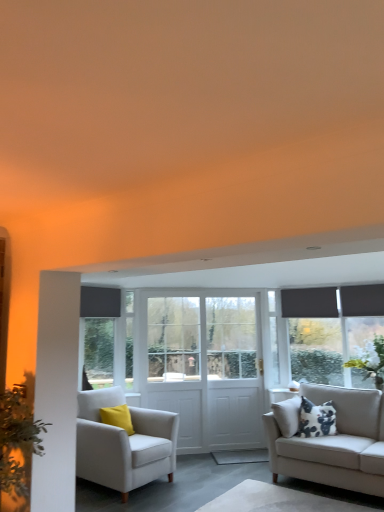
Question: Is white fabric armchair at left to the right of white wooden screen door at center, which ranks as the second screen door in right-to-left order, from the viewer's perspective?

Choices:
 (A) yes
 (B) no

Answer: (B)

Question: Is white fabric armchair at left facing towards white wooden screen door at center, acting as the 1th screen door starting from the left?

Choices:
 (A) no
 (B) yes

Answer: (A)

Question: From the image's perspective, is white fabric armchair at left under white wooden screen door at center, which ranks as the second screen door in right-to-left order?

Choices:
 (A) yes
 (B) no

Answer: (A)

Question: Is white fabric armchair at left facing away from white wooden screen door at center, which ranks as the second screen door in right-to-left order?

Choices:
 (A) yes
 (B) no

Answer: (B)

Question: Does white fabric armchair at left have a larger size compared to white wooden screen door at center, which ranks as the second screen door in right-to-left order?

Choices:
 (A) yes
 (B) no

Answer: (A)

Question: Is white fabric armchair at left positioned behind white wooden screen door at center, which ranks as the second screen door in right-to-left order?

Choices:
 (A) yes
 (B) no

Answer: (B)

Question: Does green leafy plant at left, the second plant from the back, come in front of white fabric rug at lower center?

Choices:
 (A) yes
 (B) no

Answer: (A)

Question: Can you confirm if green leafy plant at left, the first plant positioned from the left, is smaller than white fabric rug at lower center?

Choices:
 (A) no
 (B) yes

Answer: (B)

Question: Is green leafy plant at left, which is the second plant in right-to-left order, to the right of white fabric rug at lower center from the viewer's perspective?

Choices:
 (A) yes
 (B) no

Answer: (B)

Question: Considering the relative sizes of green leafy plant at left, which is the second plant in right-to-left order, and white fabric rug at lower center in the image provided, is green leafy plant at left, which is the second plant in right-to-left order, taller than white fabric rug at lower center?

Choices:
 (A) no
 (B) yes

Answer: (B)

Question: Could you tell me if green leafy plant at left, the first plant positioned from the left, is facing white fabric rug at lower center?

Choices:
 (A) no
 (B) yes

Answer: (A)

Question: Does green leafy plant at left, the second plant from the back, appear on the left side of white fabric rug at lower center?

Choices:
 (A) yes
 (B) no

Answer: (A)

Question: Is white wooden door at center, which is counted as the second screen door, starting from the left, positioned with its back to white wooden screen door at center, acting as the 1th screen door starting from the left?

Choices:
 (A) no
 (B) yes

Answer: (A)